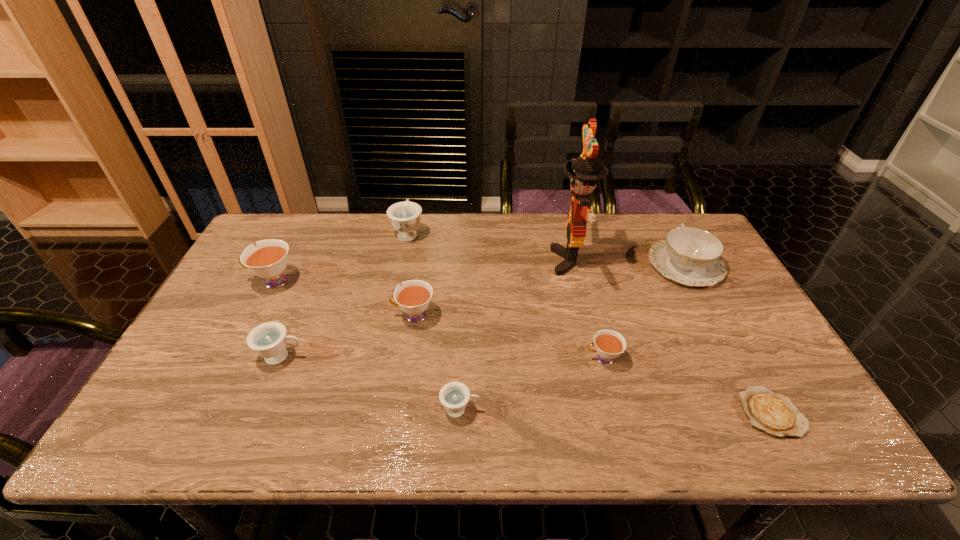
What are the coordinates of `the smallest white teacup` in the screenshot? It's located at (609, 344).

The width and height of the screenshot is (960, 540). What are the coordinates of `the rightmost white teacup` in the screenshot? It's located at (609, 344).

Where is `the smallest blue teacup`? the smallest blue teacup is located at coordinates (454, 396).

Identify the location of the fifth teacup from left to right. (454, 396).

The width and height of the screenshot is (960, 540). I want to click on brown quiche, so click(773, 413).

Find the location of a particular element. This screenshot has height=540, width=960. quiche is located at coordinates (773, 413).

You are a GUI agent. You are given a task and a screenshot of the screen. Output one action in this format:
    pyautogui.click(x=<x>, y=<y>)
    Task: Click on the vacant space located on the front-facing side of the nutcracker
    This screenshot has height=540, width=960.
    Given the screenshot: What is the action you would take?
    pyautogui.click(x=433, y=261)

In order to click on vacant space positioned on the front-facing side of the nutcracker in this screenshot , I will do `click(477, 261)`.

The image size is (960, 540). I want to click on vacant region located 0.370m on the front-facing side of the nutcracker, so click(x=436, y=261).

This screenshot has width=960, height=540. In order to click on free location located 0.060m on the side of the leftmost white teacup with the handle in this screenshot , I will do `click(228, 281)`.